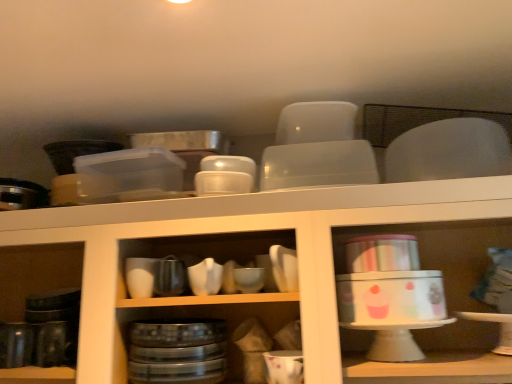
Question: Is the position of metallic tin canister at right, the second shelf when ordered from left to right, less distant than that of white glossy bowl at center, which ranks as the third tableware in right-to-left order?

Choices:
 (A) no
 (B) yes

Answer: (B)

Question: Is metallic tin canister at right, the second shelf when ordered from left to right, shorter than white glossy bowl at center, marked as the 3th tableware in a left-to-right arrangement?

Choices:
 (A) yes
 (B) no

Answer: (B)

Question: Does metallic tin canister at right, which ranks as the first shelf in right-to-left order, have a greater height compared to white glossy bowl at center, marked as the 3th tableware in a left-to-right arrangement?

Choices:
 (A) yes
 (B) no

Answer: (A)

Question: Is metallic tin canister at right, which ranks as the first shelf in right-to-left order, positioned far away from white glossy bowl at center, marked as the 3th tableware in a left-to-right arrangement?

Choices:
 (A) yes
 (B) no

Answer: (B)

Question: From the image's perspective, is metallic tin canister at right, the second shelf when ordered from left to right, above white glossy bowl at center, marked as the 3th tableware in a left-to-right arrangement?

Choices:
 (A) yes
 (B) no

Answer: (B)

Question: From a real-world perspective, is metallic tin canister at right, which ranks as the first shelf in right-to-left order, on top of white glossy bowl at center, marked as the 3th tableware in a left-to-right arrangement?

Choices:
 (A) yes
 (B) no

Answer: (B)

Question: Is matte white bowl at center, the second tableware from the left, surrounding white glossy cake stand at center, the 2th shelf viewed from the right?

Choices:
 (A) yes
 (B) no

Answer: (B)

Question: Is matte white bowl at center, which appears as the fourth tableware when viewed from the right, beside white glossy cake stand at center, marked as the first shelf in a left-to-right arrangement?

Choices:
 (A) yes
 (B) no

Answer: (B)

Question: Considering the relative sizes of matte white bowl at center, which appears as the fourth tableware when viewed from the right, and white glossy cake stand at center, the 2th shelf viewed from the right, in the image provided, is matte white bowl at center, which appears as the fourth tableware when viewed from the right, wider than white glossy cake stand at center, the 2th shelf viewed from the right,?

Choices:
 (A) yes
 (B) no

Answer: (B)

Question: From the image's perspective, is matte white bowl at center, the second tableware from the left, under white glossy cake stand at center, the 2th shelf viewed from the right?

Choices:
 (A) yes
 (B) no

Answer: (B)

Question: Is matte white bowl at center, the second tableware from the left, not within white glossy cake stand at center, marked as the first shelf in a left-to-right arrangement?

Choices:
 (A) yes
 (B) no

Answer: (B)

Question: From a real-world perspective, is matte white bowl at center, which appears as the fourth tableware when viewed from the right, physically below white glossy cake stand at center, the 2th shelf viewed from the right?

Choices:
 (A) no
 (B) yes

Answer: (A)

Question: Would you say white glossy mug at lower center, the second tableware in the right-to-left sequence, is part of matte white bowl at center, the second tableware from the left,'s contents?

Choices:
 (A) yes
 (B) no

Answer: (B)